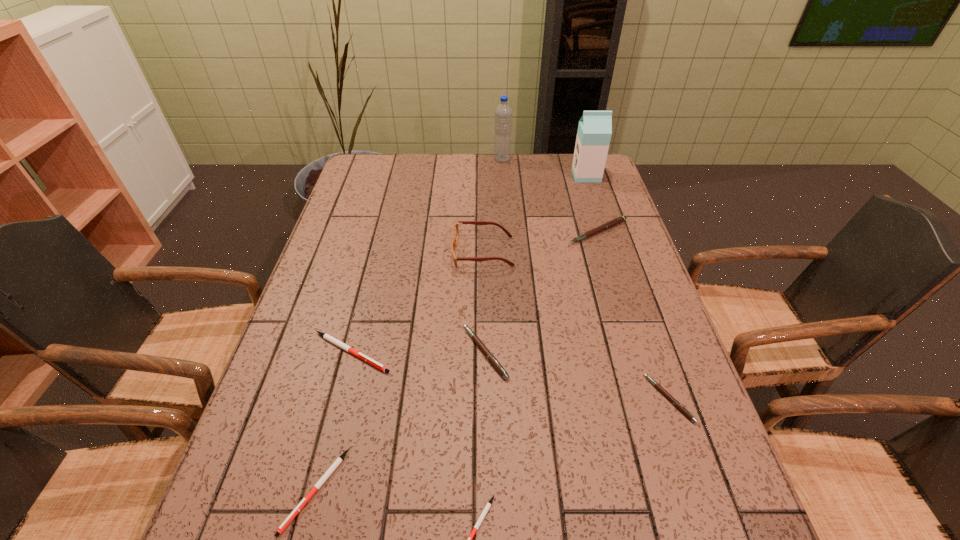
You are a GUI agent. You are given a task and a screenshot of the screen. Output one action in this format:
    pyautogui.click(x=<x>, y=<y>)
    Task: Click on the object that is positioned at the far right corner
    Image resolution: width=960 pixels, height=540 pixels.
    Given the screenshot: What is the action you would take?
    pyautogui.click(x=594, y=132)

This screenshot has width=960, height=540. Identify the location of vacant area at the far edge of the desktop. (424, 172).

At what (x,y) coordinates should I click in order to perform the action: click on free point at the left edge. Please return your answer as a coordinate pair (x, y). The image size is (960, 540). Looking at the image, I should click on (276, 429).

In the image, there is a desktop. At what (x,y) coordinates should I click in order to perform the action: click on vacant area at the right edge. Please return your answer as a coordinate pair (x, y). The height and width of the screenshot is (540, 960). Looking at the image, I should click on (709, 481).

The width and height of the screenshot is (960, 540). I want to click on vacant space that's between the milk carton and the second biggest white pen, so click(x=451, y=333).

At what (x,y) coordinates should I click in order to perform the action: click on free area in between the blue water bottle and the smallest pink pen. Please return your answer as a coordinate pair (x, y). Looking at the image, I should click on (586, 279).

I want to click on free point between the leftmost pink pen and the farthest pink pen, so click(541, 292).

I want to click on free spot between the third tallest object and the farthest white pen, so click(x=417, y=302).

Find the location of a particular element. This screenshot has width=960, height=540. free space between the seventh shortest object and the milk carton is located at coordinates (535, 213).

Where is `empty location between the white milk carton and the blue water bottle`? Image resolution: width=960 pixels, height=540 pixels. empty location between the white milk carton and the blue water bottle is located at coordinates (544, 167).